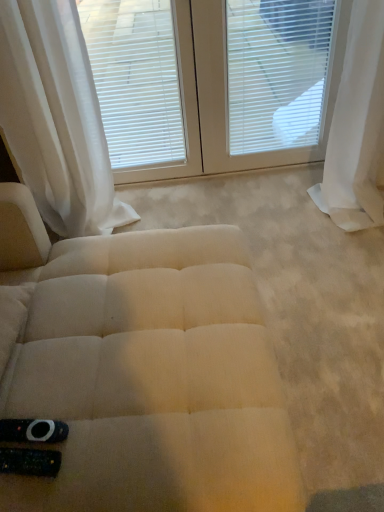
Identify the location of free space between white sheer curtain at upper left, placed as the 1th curtain when sorted from left to right, and white sheer curtain at right, the first curtain viewed from the right. (252, 212).